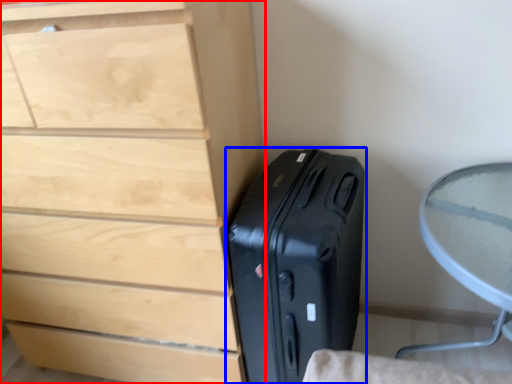
Question: Among these objects, which one is farthest to the camera, chest of drawers (highlighted by a red box) or suitcase (highlighted by a blue box)?

Choices:
 (A) chest of drawers
 (B) suitcase

Answer: (B)